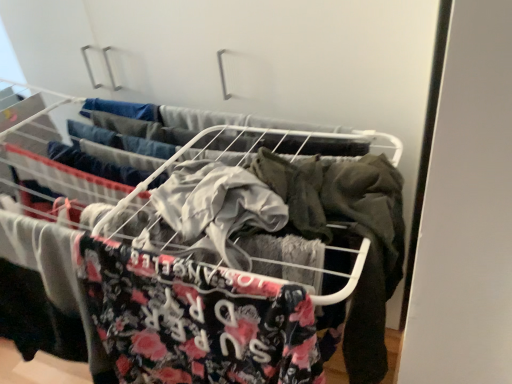
Question: Would you say gray fabric shirt at center is to the left or to the right of metal wire rack at center in the picture?

Choices:
 (A) right
 (B) left

Answer: (B)

Question: From the image's perspective, is gray fabric shirt at center positioned above or below metal wire rack at center?

Choices:
 (A) above
 (B) below

Answer: (A)

Question: In terms of height, does gray fabric shirt at center look taller or shorter compared to metal wire rack at center?

Choices:
 (A) short
 (B) tall

Answer: (A)

Question: In terms of height, does metal wire rack at center look taller or shorter compared to gray fabric shirt at center?

Choices:
 (A) tall
 (B) short

Answer: (A)

Question: From the image's perspective, is metal wire rack at center located above or below gray fabric shirt at center?

Choices:
 (A) above
 (B) below

Answer: (B)

Question: In terms of width, does metal wire rack at center look wider or thinner when compared to gray fabric shirt at center?

Choices:
 (A) wide
 (B) thin

Answer: (A)

Question: Based on their sizes in the image, would you say metal wire rack at center is bigger or smaller than gray fabric shirt at center?

Choices:
 (A) big
 (B) small

Answer: (A)